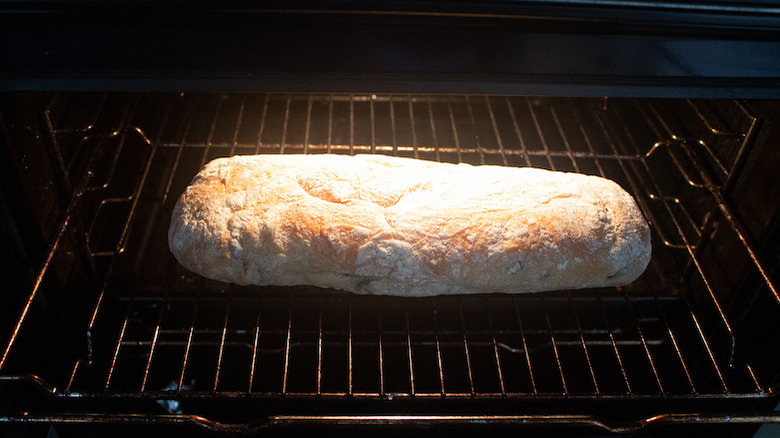
Where is `rack`? rack is located at coordinates (431, 327).